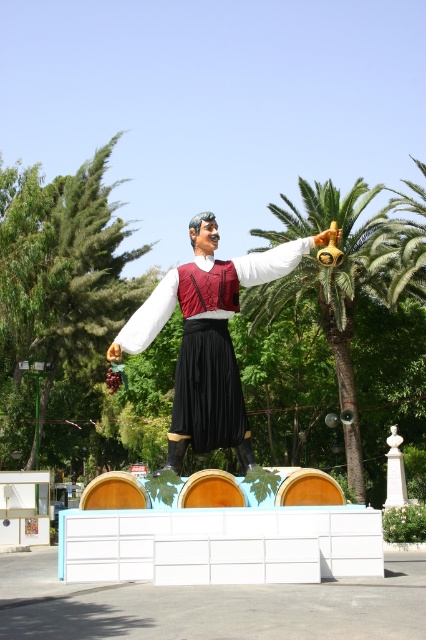
You are standing in the park and see the matte black statue at center and the green leafy palm tree at center. Which object is positioned to the left?

The matte black statue at center is to the left of the green leafy palm tree at center.

Based on the scene description, where is the matte black statue at center located in terms of its 2D coordinates?

The matte black statue at center is located at the 2D coordinates of point (207, 339).

You are standing in front of the statue and want to take a photo. You notice two points marked on the statue, one at coordinate point [198,310] and another at point [353,468]. Which point will appear closer to the camera in your photo?

Point [198,310] is closer to the camera than point [353,468], so it will appear closer in the photo.